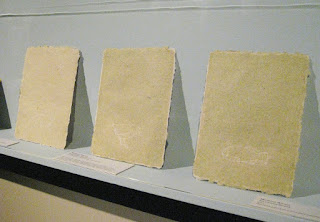
This screenshot has height=222, width=320. In order to click on horizontal line on wall in this screenshot , I will do `click(8, 15)`, `click(288, 7)`, `click(95, 3)`.